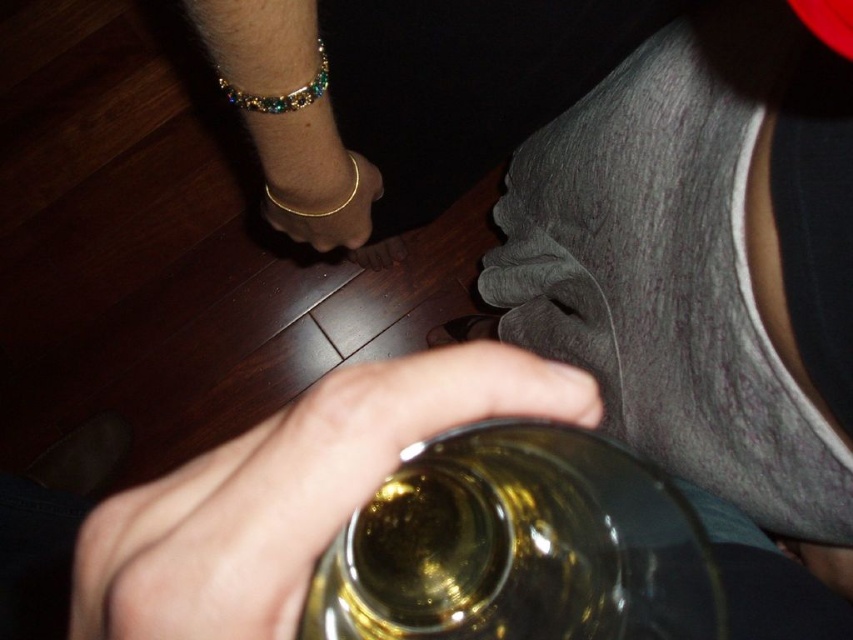
Question: Which point appears closest to the camera in this image?

Choices:
 (A) (210, 516)
 (B) (351, 163)
 (C) (323, 65)

Answer: (A)

Question: Among these objects, which one is nearest to the camera?

Choices:
 (A) translucent glass at lower center
 (B) gold metallic bracelet at center

Answer: (A)

Question: Is translucent glass at lower center above gold metallic bracelet at center?

Choices:
 (A) no
 (B) yes

Answer: (A)

Question: Does multicolored gemstone bracelet at upper left appear on the left side of gold metallic bracelet at center?

Choices:
 (A) no
 (B) yes

Answer: (A)

Question: Is translucent glass bottle at lower center above gold metallic bracelet at center?

Choices:
 (A) yes
 (B) no

Answer: (B)

Question: Which is nearer to the gold metallic bracelet at center?

Choices:
 (A) translucent glass at lower center
 (B) multicolored gemstone bracelet at upper left
 (C) translucent glass bottle at lower center

Answer: (B)